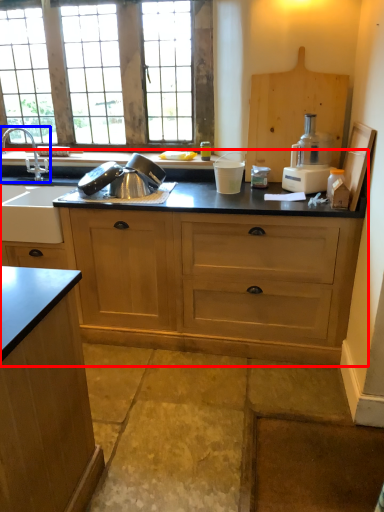
Question: Which object appears farthest to the camera in this image, countertop (highlighted by a red box) or tap (highlighted by a blue box)?

Choices:
 (A) countertop
 (B) tap

Answer: (B)